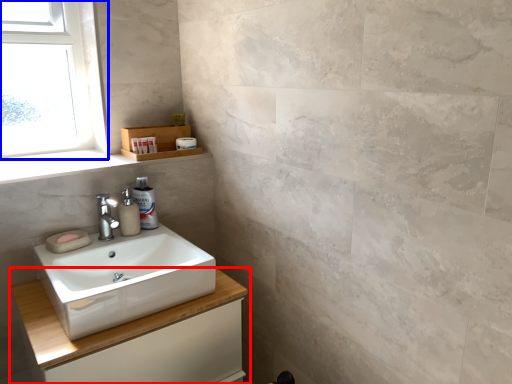
Question: Which object is further to the camera taking this photo, bathroom cabinet (highlighted by a red box) or window (highlighted by a blue box)?

Choices:
 (A) bathroom cabinet
 (B) window

Answer: (B)